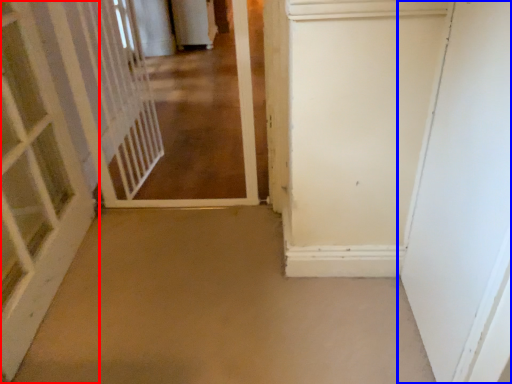
Question: Which object is further to the camera taking this photo, door (highlighted by a red box) or door (highlighted by a blue box)?

Choices:
 (A) door
 (B) door

Answer: (A)